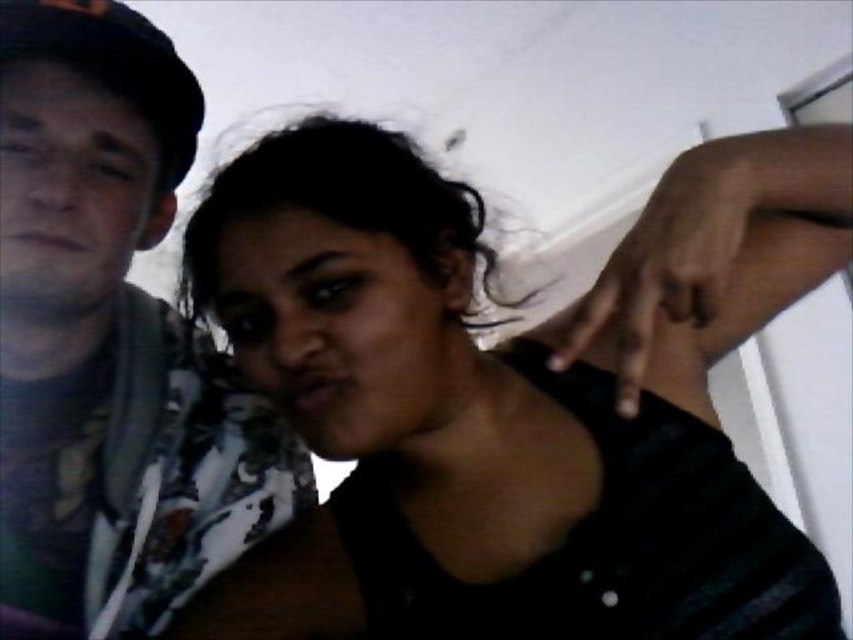
You are a photographer setting up a photo shoot. You have two subjects wearing black matte shirts. One is wearing a black matte shirt at center and the other a matte black shirt at left. You need to position them so that there is at least 10 inches between them for proper framing. Based on the current setup shown in the image, will they need to move further apart?

The black matte shirt at center and matte black shirt at left are currently 8.55 inches apart, which is less than the required 10 inches. They need to move further apart to achieve the desired spacing.

You are trying to decide which shirt to wear for a casual day out. You have the black matte shirt at center and the matte black shirt at left. Based on the image, which one has a wider silhouette?

The black matte shirt at center is wider than the matte black shirt at left, so it has a wider silhouette.